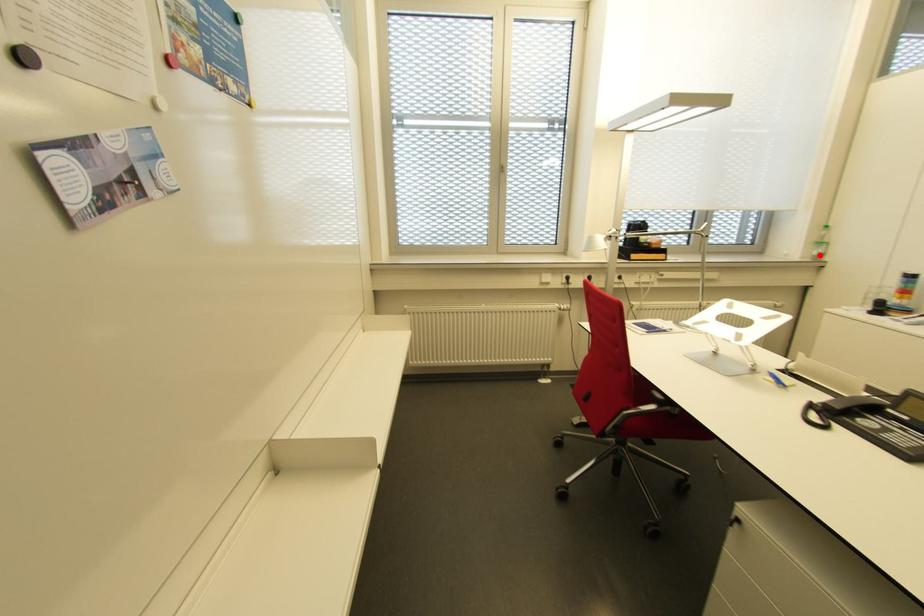
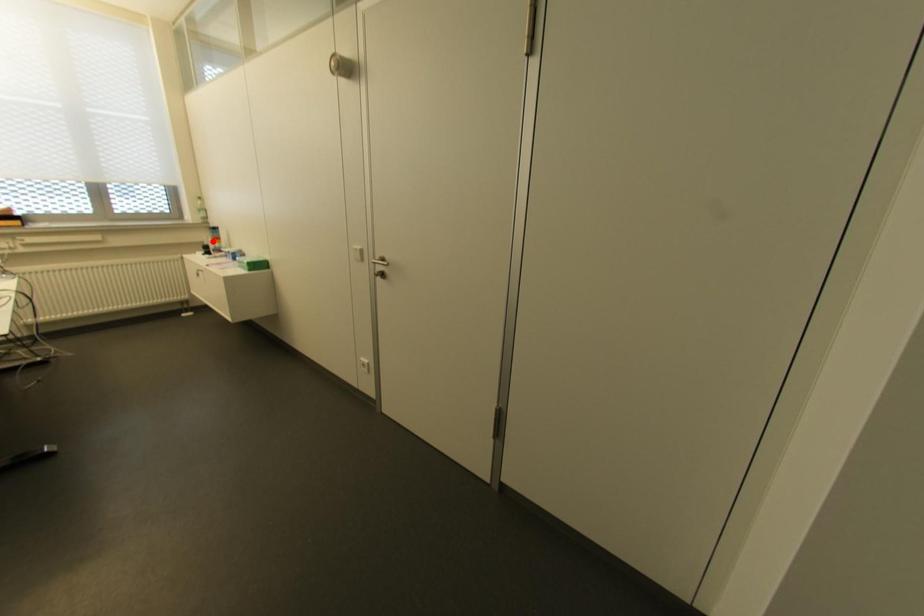
I am providing you with two images of the same scene from different viewpoints. A red point is marked on the first image and another point is marked on the second image. Is the red point in image1 aligned with the point shown in image2?

No